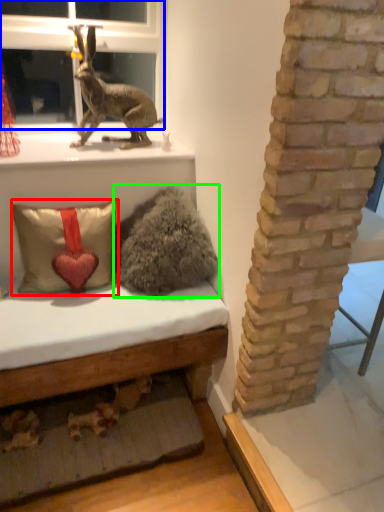
Question: Which object is positioned closest to pillow (highlighted by a red box)? Select from bay window (highlighted by a blue box) and animal (highlighted by a green box).

Choices:
 (A) bay window
 (B) animal

Answer: (B)